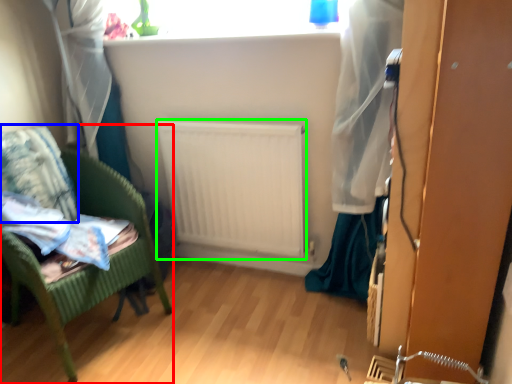
Question: Which object is the farthest from furniture (highlighted by a red box)? Choose among these: pillow (highlighted by a blue box) or radiator (highlighted by a green box).

Choices:
 (A) pillow
 (B) radiator

Answer: (B)